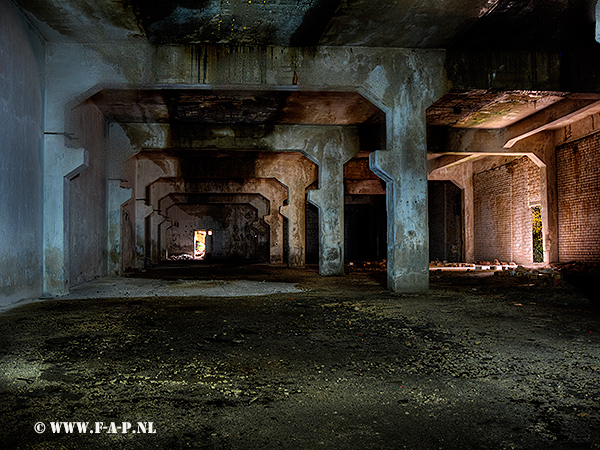
Identify the location of room. (266, 271).